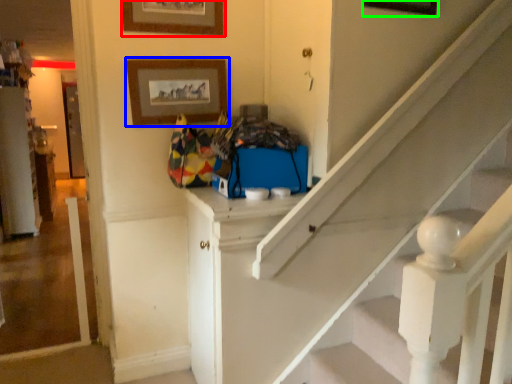
Question: Based on their relative distances, which object is nearer to picture frame (highlighted by a red box)? Choose from picture frame (highlighted by a blue box) and picture frame (highlighted by a green box).

Choices:
 (A) picture frame
 (B) picture frame

Answer: (A)